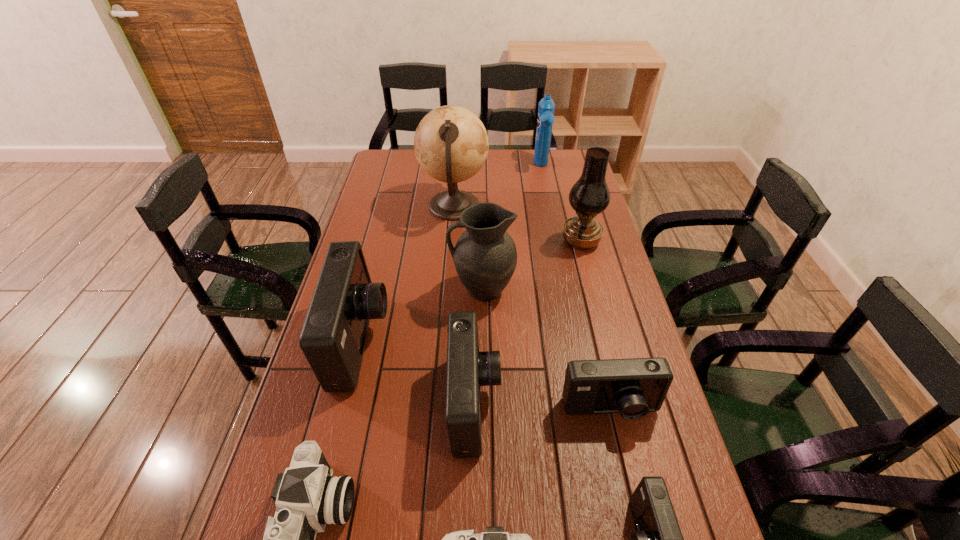
Image resolution: width=960 pixels, height=540 pixels. In order to click on blank space located on the back of the brown oil lamp in this screenshot , I will do `click(571, 202)`.

What are the coordinates of `free space located 0.250m on the front of the farthest object` in the screenshot? It's located at (550, 211).

The width and height of the screenshot is (960, 540). I want to click on vacant space located 0.130m on the side of the pitcher with the handle, so click(x=409, y=290).

You are a GUI agent. You are given a task and a screenshot of the screen. Output one action in this format:
    pyautogui.click(x=<x>, y=<y>)
    Task: Click on the free space located on the side of the pitcher with the handle
    
    Given the screenshot: What is the action you would take?
    pyautogui.click(x=337, y=290)

Locate an element on the screen. vacant space located 0.280m on the side of the pitcher with the handle is located at coordinates click(x=362, y=290).

Find the location of a particular element. blank space located 0.210m on the front-facing side of the tallest camera is located at coordinates (462, 342).

Where is `free space located on the front-facing side of the third smallest blue camera`? free space located on the front-facing side of the third smallest blue camera is located at coordinates (560, 404).

This screenshot has height=540, width=960. What are the coordinates of `free region located on the front-facing side of the third biggest blue camera` in the screenshot? It's located at (631, 501).

Identify the location of object that is positioned at the far edge. (545, 119).

What are the coordinates of `object that is positioned at the left edge` in the screenshot? It's located at (333, 336).